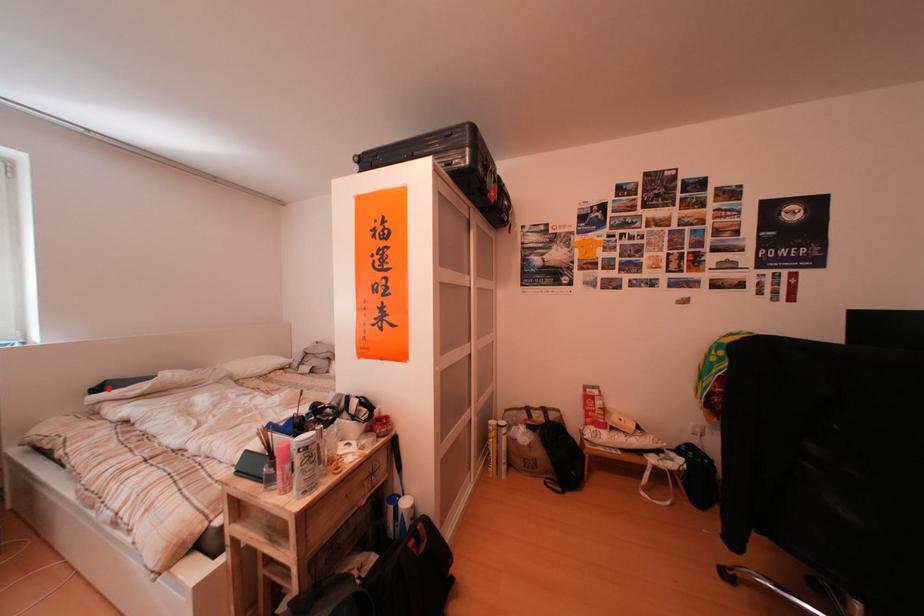
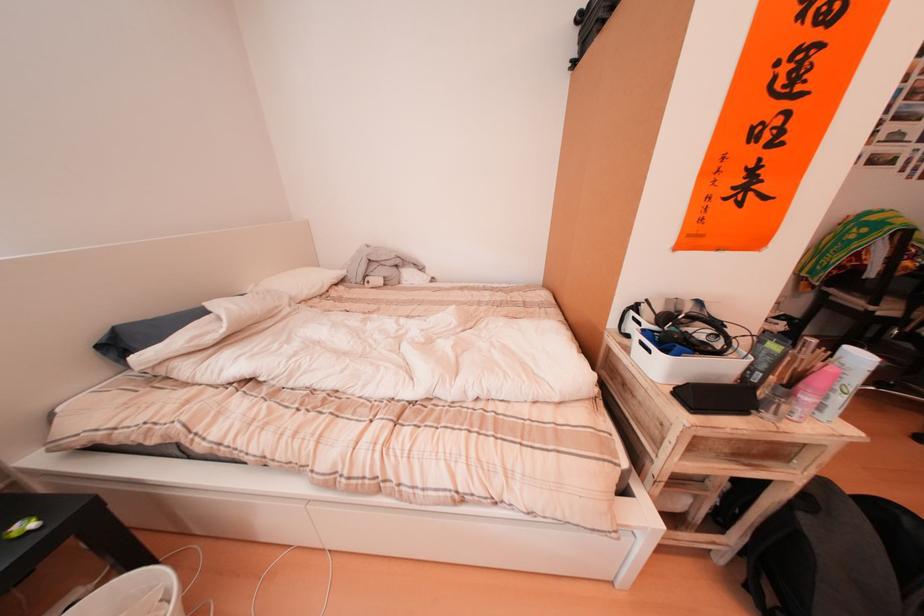
Question: I am providing you with two images of the same scene from different viewpoints. A red point is shown in image1. For the corresponding object point in image2, is it positioned nearer or farther from the camera?

Choices:
 (A) Nearer
 (B) Farther

Answer: (B)